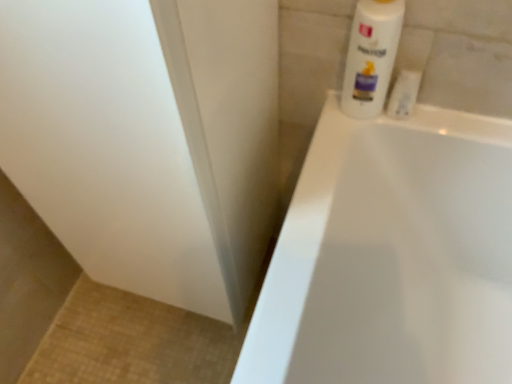
What do you see at coordinates (371, 56) in the screenshot? This screenshot has width=512, height=384. I see `white glossy lotion at upper right` at bounding box center [371, 56].

Find the location of a particular element. This screenshot has width=512, height=384. white glossy lotion at upper right is located at coordinates (371, 56).

What is the approximate height of white glossy lotion at upper right?

white glossy lotion at upper right is 8.43 inches tall.

Find the location of a particular element. This screenshot has width=512, height=384. white plastic tube at upper right is located at coordinates (404, 94).

This screenshot has width=512, height=384. What do you see at coordinates (404, 94) in the screenshot?
I see `white plastic tube at upper right` at bounding box center [404, 94].

Identify the location of white glossy lotion at upper right. (371, 56).

Is white glossy lotion at upper right at the right side of white plastic tube at upper right?

In fact, white glossy lotion at upper right is to the left of white plastic tube at upper right.

Considering their positions, is white glossy lotion at upper right located in front of or behind white plastic tube at upper right?

Clearly, white glossy lotion at upper right is in front of white plastic tube at upper right.

Is point (364, 116) less distant than point (402, 99)?

No, it is not.

From the image's perspective, which is above, white glossy lotion at upper right or white plastic tube at upper right?

white glossy lotion at upper right.

From a real-world perspective, who is located higher, white glossy lotion at upper right or white plastic tube at upper right?

white glossy lotion at upper right.

Between white glossy lotion at upper right and white plastic tube at upper right, which one has smaller width?

Thinner between the two is white plastic tube at upper right.

Is white glossy lotion at upper right shorter than white plastic tube at upper right?

No.

Looking at the image, does white glossy lotion at upper right seem bigger or smaller compared to white plastic tube at upper right?

Clearly, white glossy lotion at upper right is larger in size than white plastic tube at upper right.

Is white glossy lotion at upper right inside or outside of white plastic tube at upper right?

white glossy lotion at upper right is not inside white plastic tube at upper right, it's outside.

Is there a large distance between white glossy lotion at upper right and white plastic tube at upper right?

white glossy lotion at upper right is near white plastic tube at upper right, not far away.

Is white glossy lotion at upper right looking in the opposite direction of white plastic tube at upper right?

white glossy lotion at upper right does not have its back to white plastic tube at upper right.

Locate an element on the screen. toiletry below the white glossy lotion at upper right (from a real-world perspective) is located at coordinates (404, 94).

Which is more to the right, white plastic tube at upper right or white glossy lotion at upper right?

white plastic tube at upper right is more to the right.

Is white plastic tube at upper right in front of white glossy lotion at upper right?

No, white plastic tube at upper right is behind white glossy lotion at upper right.

Which is in front, point (415, 93) or point (382, 78)?

Positioned in front is point (382, 78).

From the image's perspective, is white plastic tube at upper right above white glossy lotion at upper right?

Incorrect, from the image's perspective, white plastic tube at upper right is lower than white glossy lotion at upper right.

From a real-world perspective, is white plastic tube at upper right positioned above or below white glossy lotion at upper right?

white plastic tube at upper right is situated lower than white glossy lotion at upper right in the real world.

Is white plastic tube at upper right thinner than white glossy lotion at upper right?

Yes.

Can you confirm if white plastic tube at upper right is shorter than white glossy lotion at upper right?

Correct, white plastic tube at upper right is not as tall as white glossy lotion at upper right.

Is white plastic tube at upper right smaller than white glossy lotion at upper right?

Yes.

Is white glossy lotion at upper right located within white plastic tube at upper right?

No, white glossy lotion at upper right is not a part of white plastic tube at upper right.

Is white plastic tube at upper right positioned far away from white glossy lotion at upper right?

No, white plastic tube at upper right is in close proximity to white glossy lotion at upper right.

Does white plastic tube at upper right turn towards white glossy lotion at upper right?

No, white plastic tube at upper right does not turn towards white glossy lotion at upper right.

What's the angular difference between white plastic tube at upper right and white glossy lotion at upper right's facing directions?

There is a 1.36-degree angle between the facing directions of white plastic tube at upper right and white glossy lotion at upper right.

Where is `toiletry behind the white glossy lotion at upper right`? toiletry behind the white glossy lotion at upper right is located at coordinates (404, 94).

Where is `cleaning product in front of the white plastic tube at upper right`? The width and height of the screenshot is (512, 384). cleaning product in front of the white plastic tube at upper right is located at coordinates (371, 56).

At what (x,y) coordinates should I click in order to perform the action: click on cleaning product above the white plastic tube at upper right (from a real-world perspective). Please return your answer as a coordinate pair (x, y). Looking at the image, I should click on (371, 56).